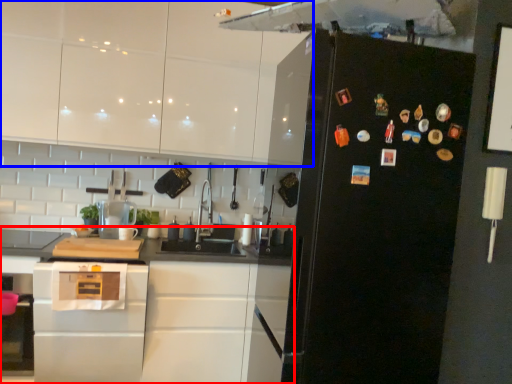
Question: Which object is further to the camera taking this photo, cabinetry (highlighted by a red box) or cabinetry (highlighted by a blue box)?

Choices:
 (A) cabinetry
 (B) cabinetry

Answer: (B)